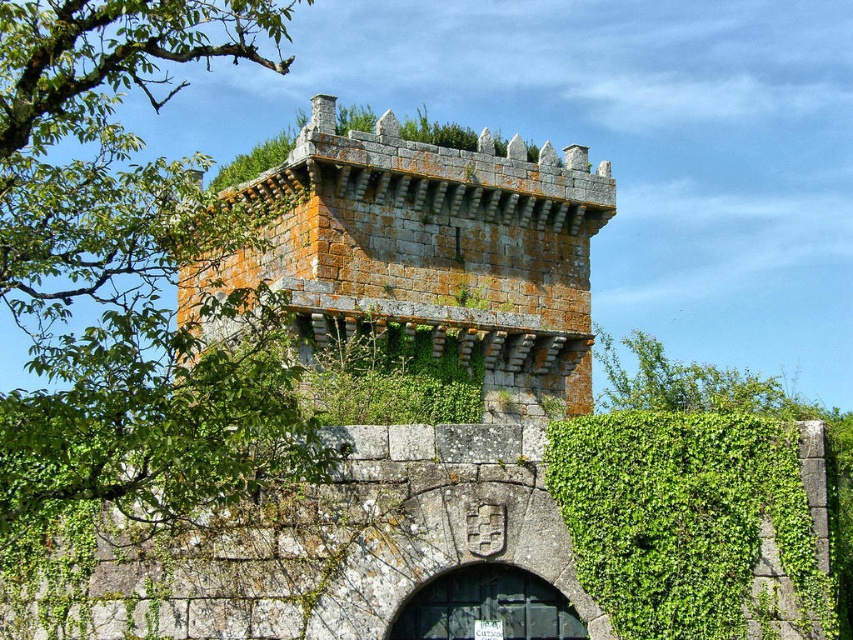
Question: Which of the following is the closest to the observer?

Choices:
 (A) gray stone tower at center
 (B) green leafy tree at upper left

Answer: (B)

Question: Can you confirm if green leafy tree at upper left is positioned to the left of gray stone tower at center?

Choices:
 (A) yes
 (B) no

Answer: (A)

Question: Which point appears closest to the camera in this image?

Choices:
 (A) [344, 292]
 (B) [793, 483]
 (C) [109, 193]

Answer: (C)

Question: Based on their relative distances, which object is nearer to the gray stone tower at center?

Choices:
 (A) green leafy tree at upper left
 (B) green leafy hedge at lower right

Answer: (A)

Question: Is green leafy tree at upper left smaller than green leafy hedge at lower right?

Choices:
 (A) no
 (B) yes

Answer: (A)

Question: Is gray stone tower at center to the right of green leafy hedge at lower right from the viewer's perspective?

Choices:
 (A) yes
 (B) no

Answer: (B)